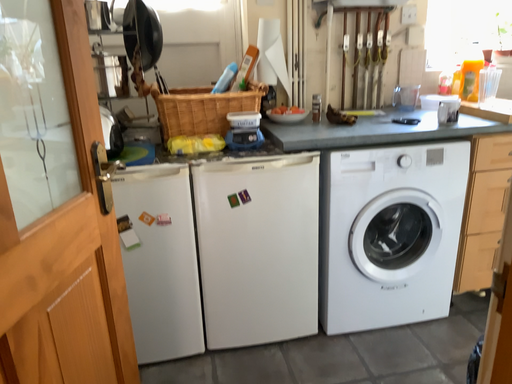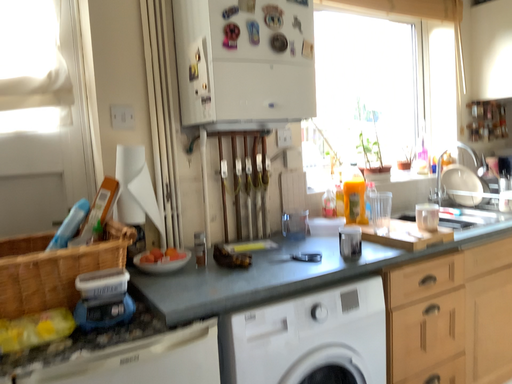
Question: How did the camera likely rotate when shooting the video?

Choices:
 (A) rotated right
 (B) rotated left

Answer: (A)